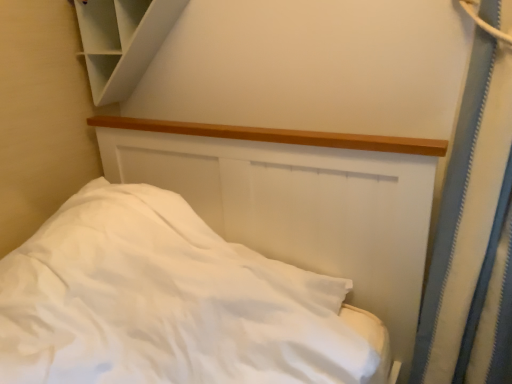
Question: Does white matte bed at center have a lesser height compared to white matte cabinet at upper left?

Choices:
 (A) no
 (B) yes

Answer: (A)

Question: Is white matte bed at center to the right of white matte cabinet at upper left from the viewer's perspective?

Choices:
 (A) no
 (B) yes

Answer: (B)

Question: Is white matte bed at center positioned in front of white matte cabinet at upper left?

Choices:
 (A) yes
 (B) no

Answer: (A)

Question: Would you say white matte bed at center is a long distance from white matte cabinet at upper left?

Choices:
 (A) no
 (B) yes

Answer: (A)

Question: Is white matte bed at center wider than white matte cabinet at upper left?

Choices:
 (A) yes
 (B) no

Answer: (A)

Question: Is white matte bed at center completely or partially outside of white matte cabinet at upper left?

Choices:
 (A) no
 (B) yes

Answer: (B)

Question: Is white matte cabinet at upper left oriented towards white matte bed at center?

Choices:
 (A) yes
 (B) no

Answer: (B)

Question: Is white matte cabinet at upper left shorter than white matte bed at center?

Choices:
 (A) no
 (B) yes

Answer: (B)

Question: From a real-world perspective, is white matte cabinet at upper left on white matte bed at center?

Choices:
 (A) no
 (B) yes

Answer: (B)

Question: Is white matte cabinet at upper left next to white matte bed at center and touching it?

Choices:
 (A) yes
 (B) no

Answer: (B)

Question: Can you confirm if white matte cabinet at upper left is smaller than white matte bed at center?

Choices:
 (A) no
 (B) yes

Answer: (B)

Question: Considering the relative sizes of white matte cabinet at upper left and white matte bed at center in the image provided, is white matte cabinet at upper left bigger than white matte bed at center?

Choices:
 (A) no
 (B) yes

Answer: (A)

Question: From a real-world perspective, is white matte bed at center physically located above or below white matte cabinet at upper left?

Choices:
 (A) below
 (B) above

Answer: (A)